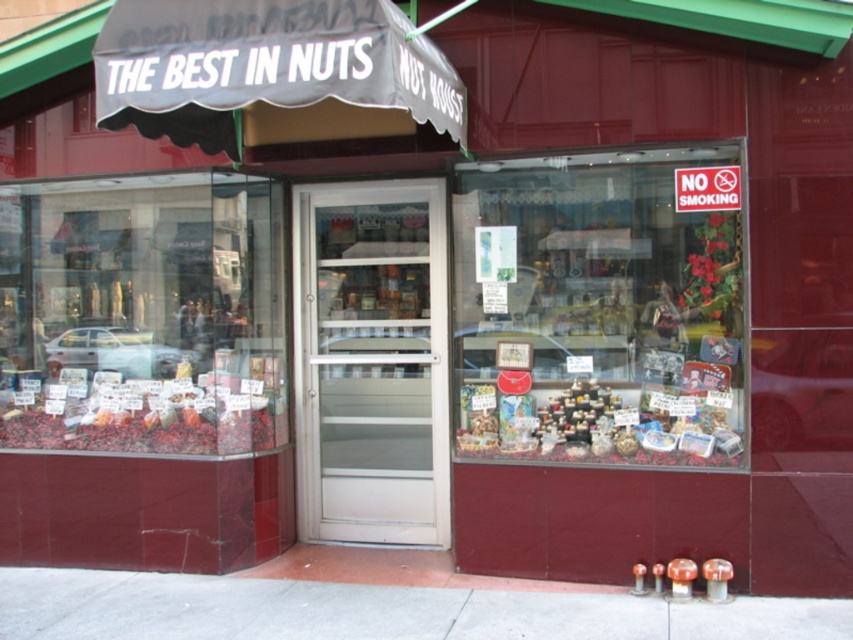
Between gray concrete sidewalk at lower center and shiny metallic nuts at lower left, which one has less height?

With less height is gray concrete sidewalk at lower center.

Can you confirm if gray concrete sidewalk at lower center is thinner than shiny metallic nuts at lower left?

Incorrect, gray concrete sidewalk at lower center's width is not less than shiny metallic nuts at lower left's.

Locate an element on the screen. This screenshot has width=853, height=640. gray concrete sidewalk at lower center is located at coordinates (381, 609).

Find the location of `gray concrete sidewalk at lower center`. gray concrete sidewalk at lower center is located at coordinates (381, 609).

Can you confirm if gray concrete sidewalk at lower center is positioned below shiny plastic containers at center?

Indeed, gray concrete sidewalk at lower center is positioned under shiny plastic containers at center.

Find the location of a particular element. This screenshot has height=640, width=853. gray concrete sidewalk at lower center is located at coordinates (381, 609).

Describe the element at coordinates (370, 362) in the screenshot. I see `white frosted glass door at center` at that location.

Does white frosted glass door at center have a lesser width compared to shiny plastic containers at center?

Correct, white frosted glass door at center's width is less than shiny plastic containers at center's.

Between point (345, 266) and point (553, 413), which one is positioned behind?

Point (345, 266)

Find the location of a particular element. The width and height of the screenshot is (853, 640). white frosted glass door at center is located at coordinates (370, 362).